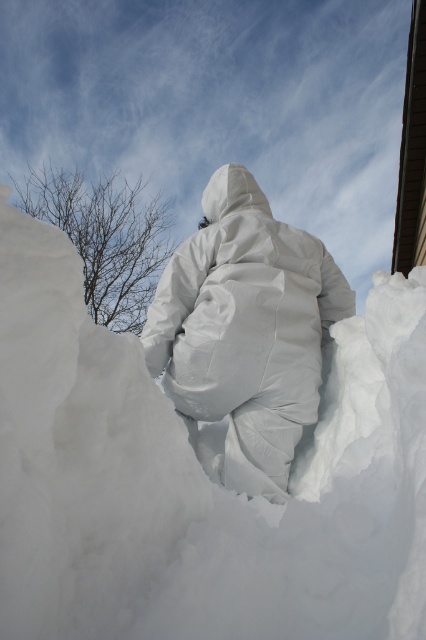
Question: Does white fluffy snow at center have a smaller size compared to white matte snowsuit at center?

Choices:
 (A) yes
 (B) no

Answer: (A)

Question: From the image, what is the correct spatial relationship of white fluffy snow at center in relation to white matte snowsuit at center?

Choices:
 (A) above
 (B) below

Answer: (B)

Question: Which object is closer to the camera taking this photo?

Choices:
 (A) white fluffy snow at center
 (B) white matte snowsuit at center

Answer: (A)

Question: Among these points, which one is nearest to the camera?

Choices:
 (A) (48, 506)
 (B) (166, 312)

Answer: (A)

Question: Does white fluffy snow at center appear on the right side of white matte snowsuit at center?

Choices:
 (A) yes
 (B) no

Answer: (B)

Question: Which point appears farthest from the camera in this image?

Choices:
 (A) (100, 516)
 (B) (247, 284)

Answer: (B)